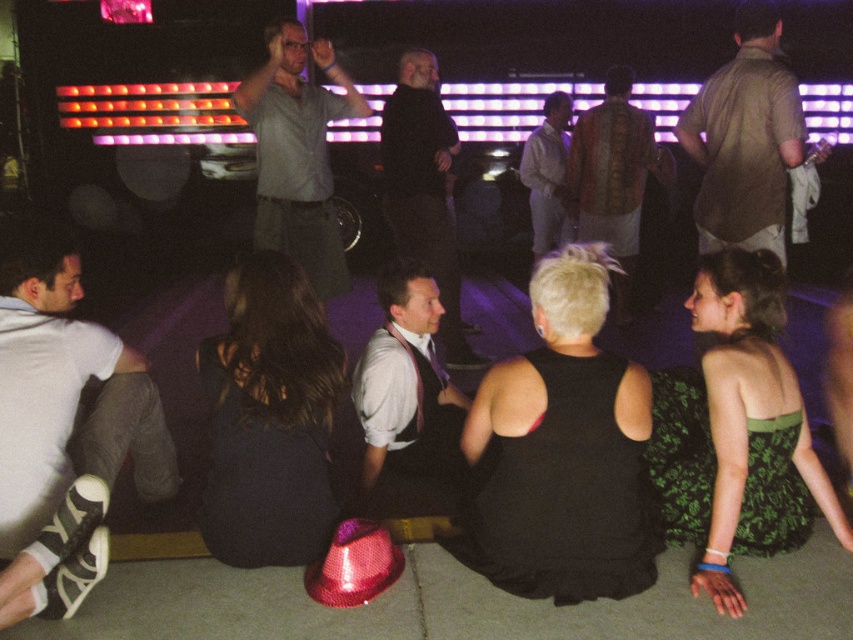
You are at a party and need to find a place to sit. You see the gray cotton shirt at center and the dark matte suit at center. Which person is wearing a smaller clothing item?

The gray cotton shirt at center is smaller than the dark matte suit at center, so the person wearing the gray cotton shirt at center has the smaller clothing item.

You are organizing a photo shoot and need to arrange two outfits side by side. The green floral dress at lower right and the patterned fabric shirt at center must be placed on mannequins. Given their sizes, which outfit requires a wider mannequin?

The patterned fabric shirt at center requires a wider mannequin because the green floral dress at lower right has a smaller width than the patterned fabric shirt at center.